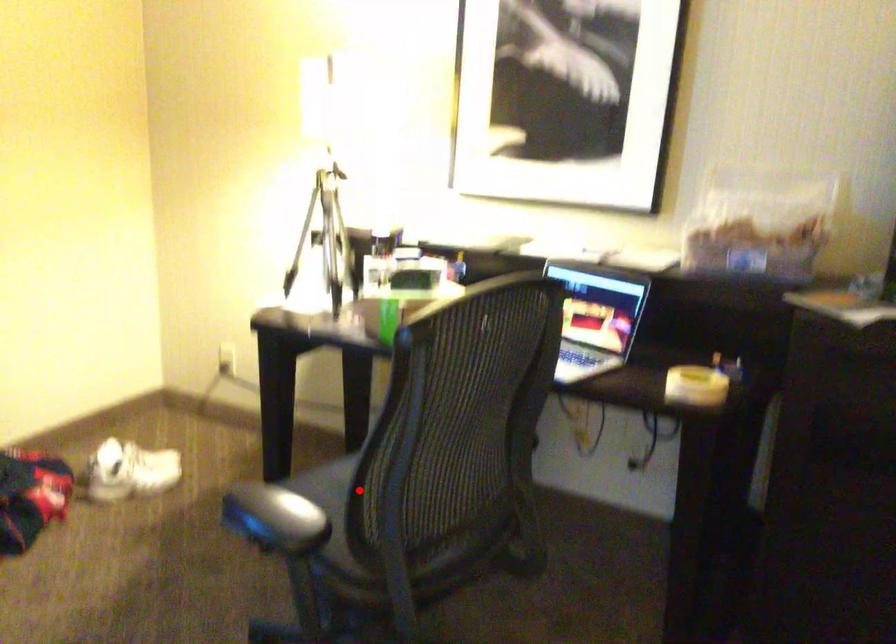
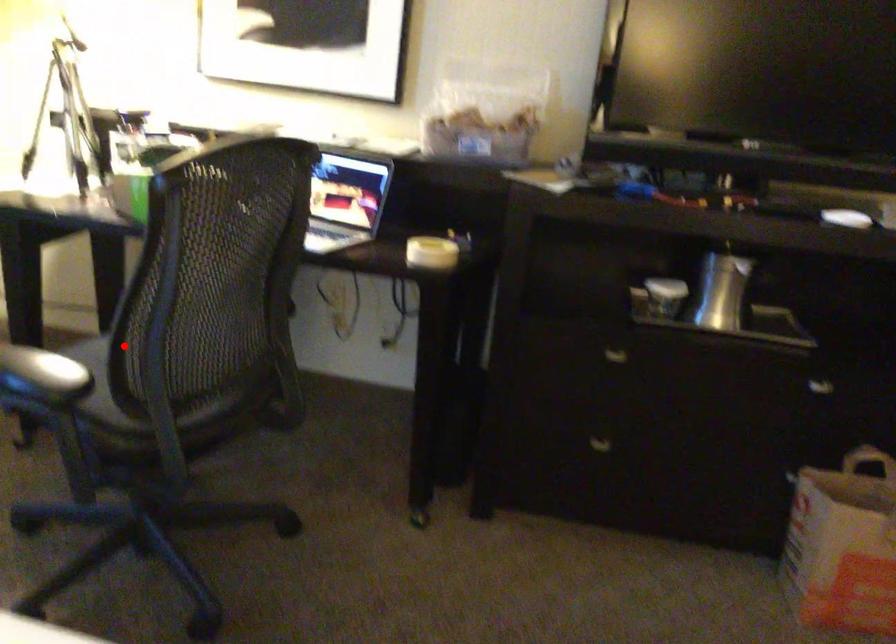
I am providing you with two images of the same scene from different viewpoints. A red point is marked on the first image and another point is marked on the second image. Are the points marked in image1 and image2 representing the same 3D position?

Yes